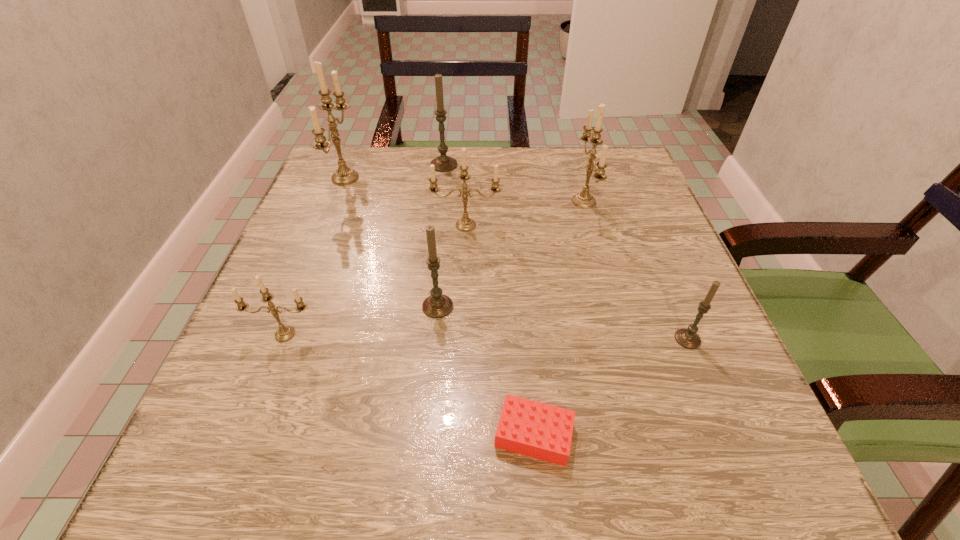
The width and height of the screenshot is (960, 540). Identify the location of vacant region located on the back of the shortest object. (526, 349).

You are a GUI agent. You are given a task and a screenshot of the screen. Output one action in this format:
    pyautogui.click(x=<x>, y=<y>)
    Task: Click on the object that is at the near edge
    
    Given the screenshot: What is the action you would take?
    pyautogui.click(x=534, y=429)

This screenshot has height=540, width=960. Find the location of `object situated at the far left corner`. object situated at the far left corner is located at coordinates (343, 176).

What are the coordinates of `object positioned at the far right corner` in the screenshot? It's located at (584, 199).

The width and height of the screenshot is (960, 540). Identify the location of blank space at the far edge of the desktop. (566, 168).

Identify the location of vacant space at the near edge of the desktop. This screenshot has height=540, width=960. (366, 479).

This screenshot has width=960, height=540. Find the location of `vacant position at the left edge of the desktop`. vacant position at the left edge of the desktop is located at coordinates (293, 365).

Identify the location of vacant space at the right edge of the desktop. The image size is (960, 540). pos(662,354).

In the image, there is a desktop. At what (x,y) coordinates should I click in order to perform the action: click on vacant space at the far left corner. Please return your answer as a coordinate pair (x, y). The image size is (960, 540). Looking at the image, I should click on (325, 193).

Where is `free point at the far right corner`? Image resolution: width=960 pixels, height=540 pixels. free point at the far right corner is located at coordinates (579, 166).